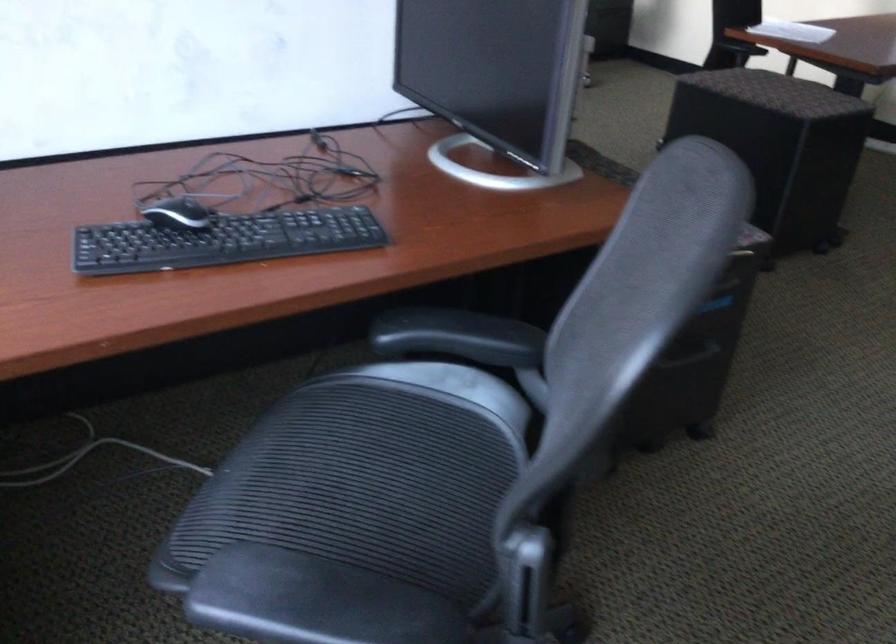
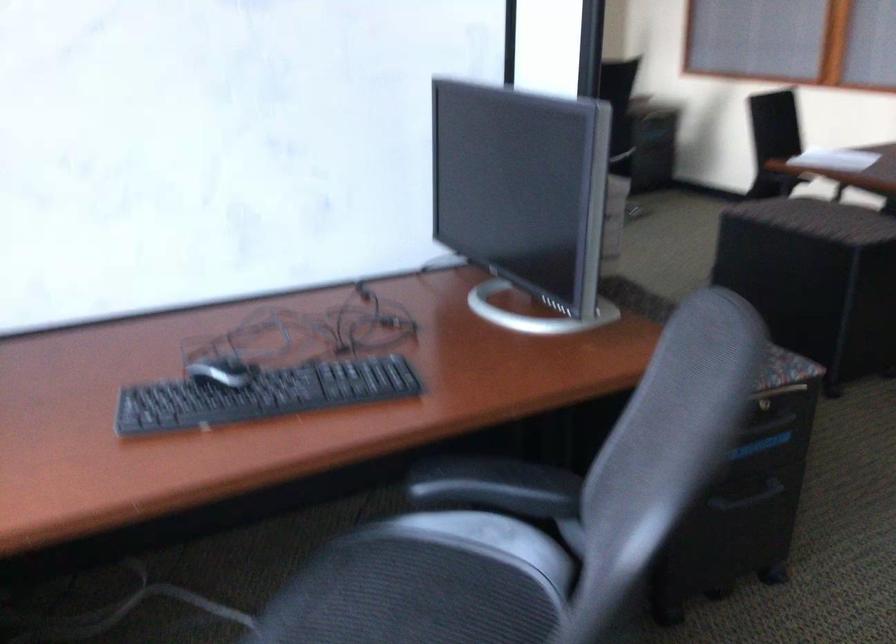
Question: The first image is from the beginning of the video and the second image is from the end. How did the camera likely rotate when shooting the video?

Choices:
 (A) Left
 (B) Right
 (C) Up
 (D) Down

Answer: (C)